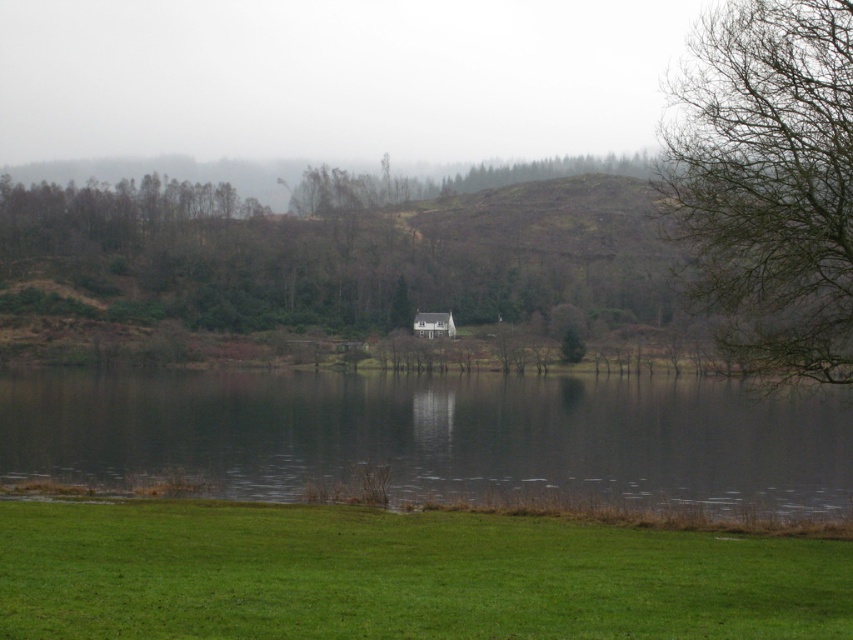
Question: Is dark reflective water at center behind bare branches at right?

Choices:
 (A) no
 (B) yes

Answer: (B)

Question: Does bare branches at right have a larger size compared to white wooden hut at center?

Choices:
 (A) no
 (B) yes

Answer: (B)

Question: Which object is closer to the camera taking this photo?

Choices:
 (A) white wooden hut at center
 (B) green grass at lower center
 (C) bare branches at right
 (D) dark reflective water at center

Answer: (B)

Question: Which object is positioned farthest from the dark reflective water at center?

Choices:
 (A) white wooden hut at center
 (B) bare branches at right

Answer: (B)

Question: Can you confirm if green grass at lower center is positioned to the left of white wooden hut at center?

Choices:
 (A) no
 (B) yes

Answer: (A)

Question: Estimate the real-world distances between objects in this image. Which object is closer to the dark reflective water at center?

Choices:
 (A) bare branches at right
 (B) green grass at lower center

Answer: (B)